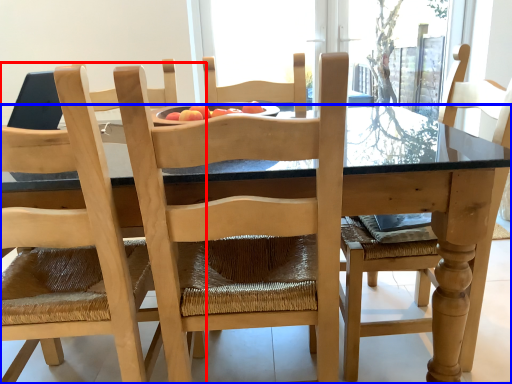
Question: Which point is closer to the camera, chair (highlighted by a red box) or kitchen & dining room table (highlighted by a blue box)?

Choices:
 (A) chair
 (B) kitchen & dining room table

Answer: (A)